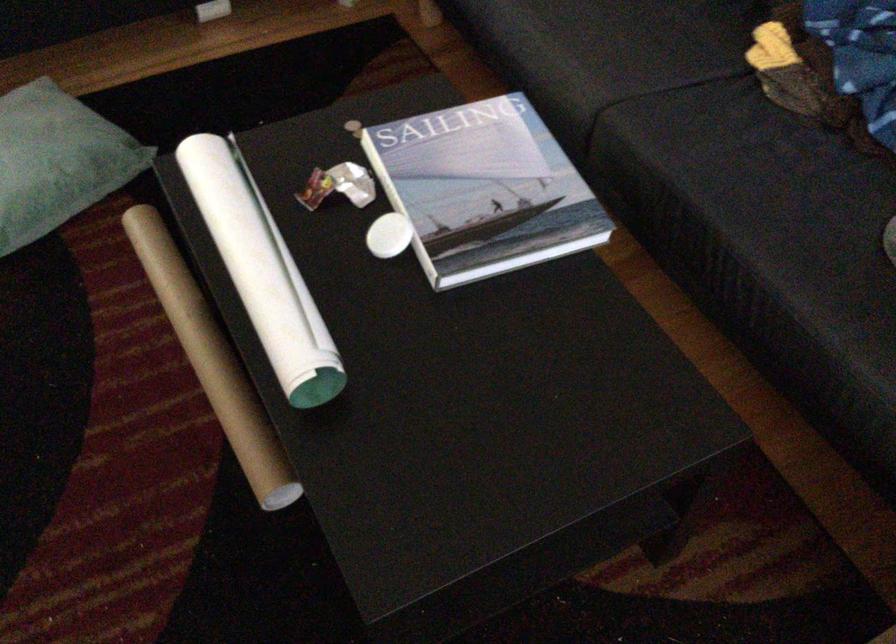
This screenshot has width=896, height=644. What are the coordinates of `cardboard tube` in the screenshot? It's located at (212, 361).